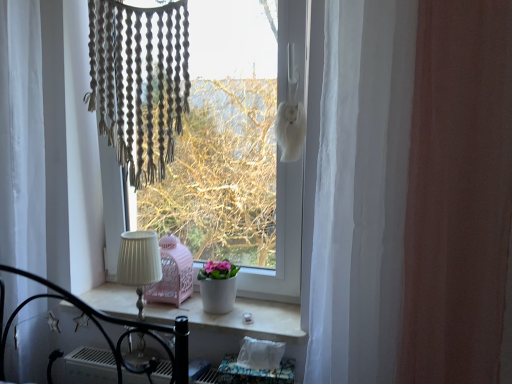
Question: Can you confirm if white ceramic window sill at center is thinner than white matte pot at center?

Choices:
 (A) no
 (B) yes

Answer: (A)

Question: Is white matte pot at center a part of white ceramic window sill at center?

Choices:
 (A) no
 (B) yes

Answer: (A)

Question: Is white ceramic window sill at center further to the viewer compared to white matte pot at center?

Choices:
 (A) no
 (B) yes

Answer: (A)

Question: From the image's perspective, is white ceramic window sill at center below white matte pot at center?

Choices:
 (A) no
 (B) yes

Answer: (B)

Question: From the image's perspective, would you say white ceramic window sill at center is positioned over white matte pot at center?

Choices:
 (A) no
 (B) yes

Answer: (A)

Question: From the image's perspective, is white pleated fabric at center located above or below white sheer curtain at left, the 2th curtain from the front?

Choices:
 (A) above
 (B) below

Answer: (B)

Question: Considering their positions, is white pleated fabric at center located in front of or behind white sheer curtain at left, the 2th curtain from the front?

Choices:
 (A) behind
 (B) front

Answer: (A)

Question: In terms of height, does white pleated fabric at center look taller or shorter compared to white sheer curtain at left, the second curtain when ordered from right to left?

Choices:
 (A) tall
 (B) short

Answer: (B)

Question: Which is correct: white pleated fabric at center is inside white sheer curtain at left, the 2th curtain from the front, or outside of it?

Choices:
 (A) inside
 (B) outside

Answer: (B)

Question: Considering the positions of white pleated fabric at center and white sheer curtain at right, which is counted as the 2th curtain, starting from the back, in the image, is white pleated fabric at center wider or thinner than white sheer curtain at right, which is counted as the 2th curtain, starting from the back,?

Choices:
 (A) thin
 (B) wide

Answer: (A)

Question: From the image's perspective, is white pleated fabric at center located above or below white sheer curtain at right, which is counted as the 2th curtain, starting from the back?

Choices:
 (A) above
 (B) below

Answer: (B)

Question: Is white pleated fabric at center bigger or smaller than white sheer curtain at right, which appears as the 2th curtain when viewed from the left?

Choices:
 (A) small
 (B) big

Answer: (A)

Question: Considering the relative positions of white pleated fabric at center and white sheer curtain at right, which appears as the first curtain when viewed from the front, in the image provided, is white pleated fabric at center to the left or to the right of white sheer curtain at right, which appears as the first curtain when viewed from the front,?

Choices:
 (A) left
 (B) right

Answer: (A)

Question: Relative to white matte window at center, is white sheer curtain at right, which appears as the first curtain when viewed from the front, in front or behind?

Choices:
 (A) behind
 (B) front

Answer: (B)

Question: Based on their positions, is white sheer curtain at right, which is counted as the 2th curtain, starting from the back, located to the left or right of white matte window at center?

Choices:
 (A) left
 (B) right

Answer: (B)